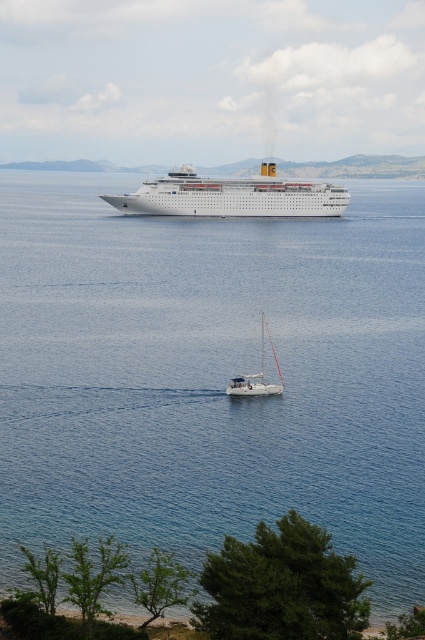
You are a sailor on the white glossy cruise ship at center. You want to check the water quality below your ship. Which direction should you look to see the clear blue water at center?

The clear blue water at center is located below the white glossy cruise ship at center. Therefore, the sailor should look downward towards the clear blue water at center to check the water quality.

You are a photographer planning to capture a photo of the white glossy cruise ship at center and the white matte sailboat at center from the shore. Which vessel will appear larger in the photo?

The white glossy cruise ship at center will appear larger in the photo because it is much taller than the white matte sailboat at center.

You are a marine biologist observing the scene. You need to determine the position of the white glossy cruise ship at center relative to the sailboat. Which coordinate point is the cruise ship located at?

The white glossy cruise ship at center is located at point (232,195).